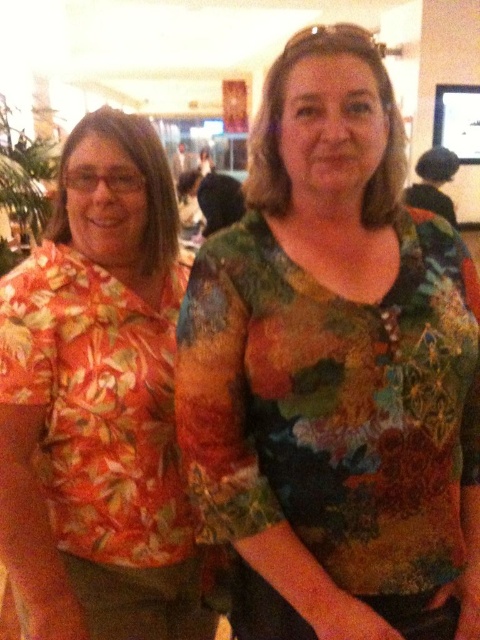
Does floral fabric blouse at center have a lesser height compared to orange floral shirt at left?

Yes.

Which is below, floral fabric blouse at center or orange floral shirt at left?

orange floral shirt at left is below.

This screenshot has width=480, height=640. What do you see at coordinates (335, 371) in the screenshot?
I see `floral fabric blouse at center` at bounding box center [335, 371].

Where is `floral fabric blouse at center`? floral fabric blouse at center is located at coordinates (335, 371).